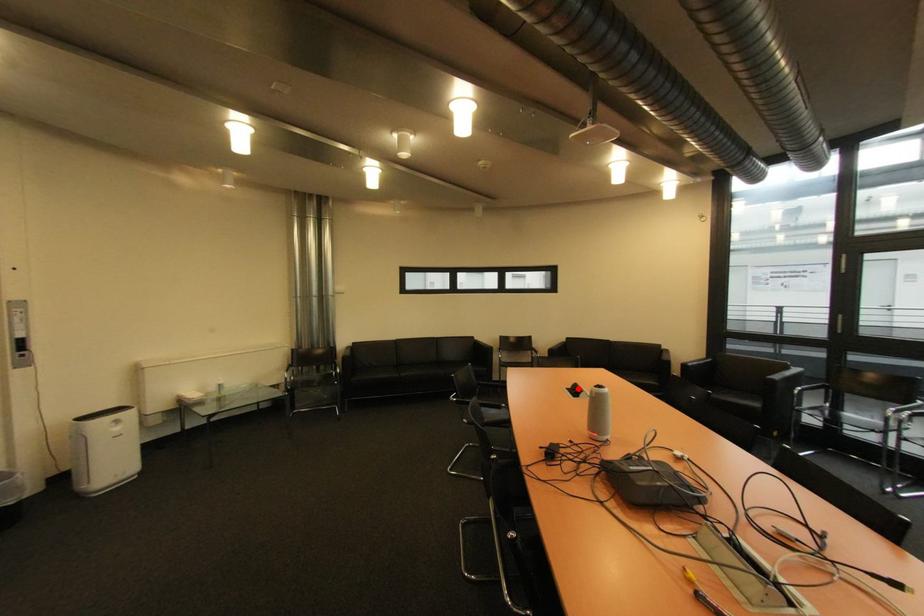
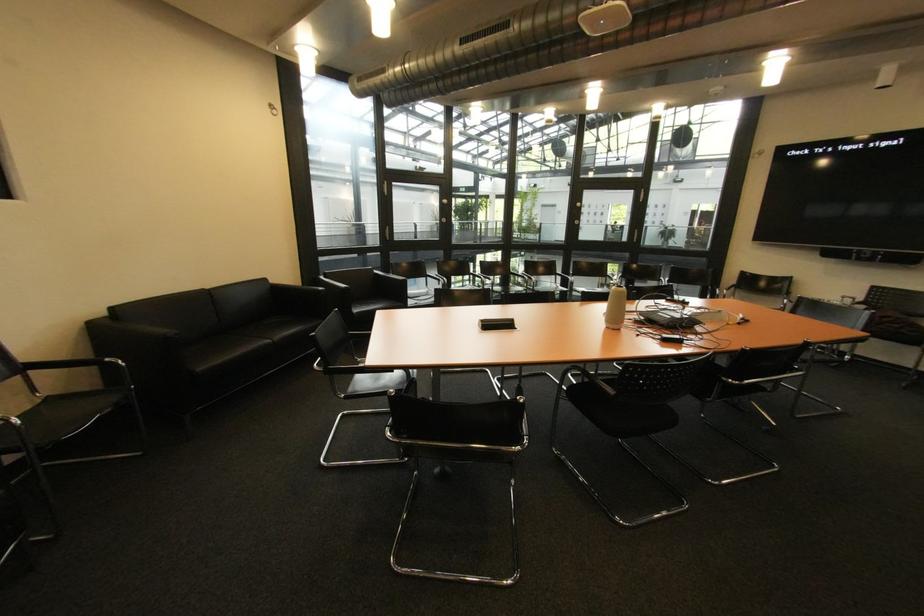
Question: I am providing you with two images of the same scene from different viewpoints. A red point is marked on the first image. Can you still see the location of the red point in image 2?

Choices:
 (A) Yes
 (B) No

Answer: (B)